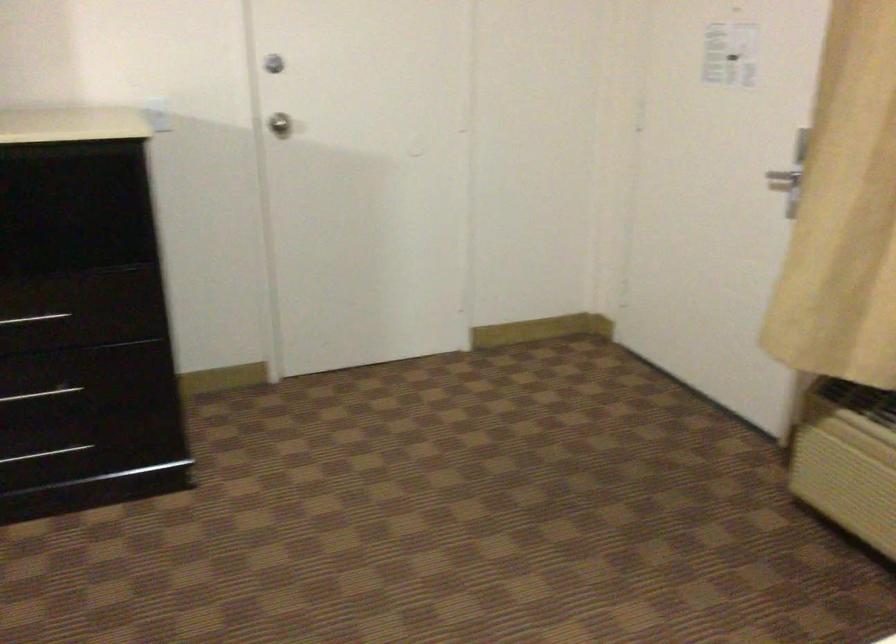
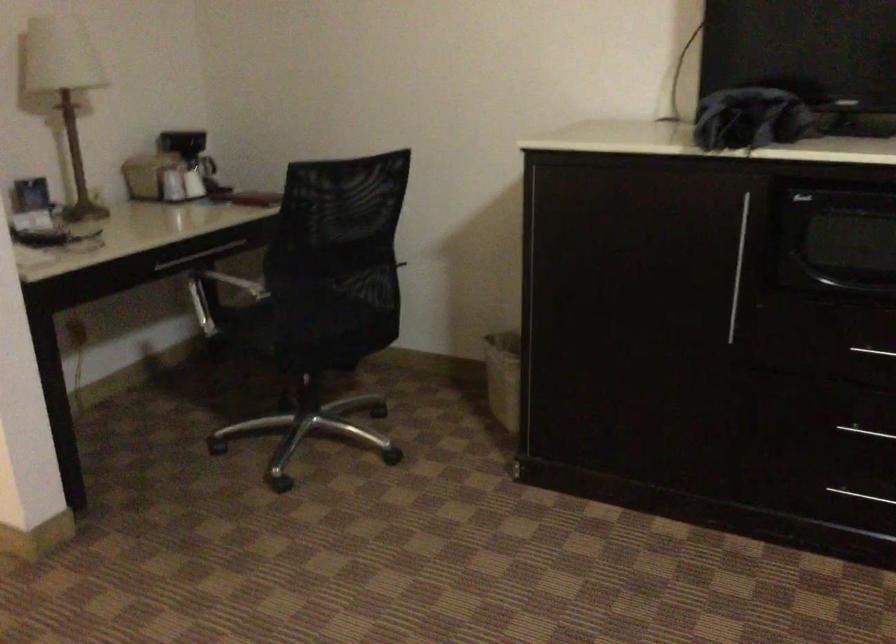
Question: The first image is from the beginning of the video and the second image is from the end. How did the camera likely rotate when shooting the video?

Choices:
 (A) Left
 (B) Right
 (C) Up
 (D) Down

Answer: (A)